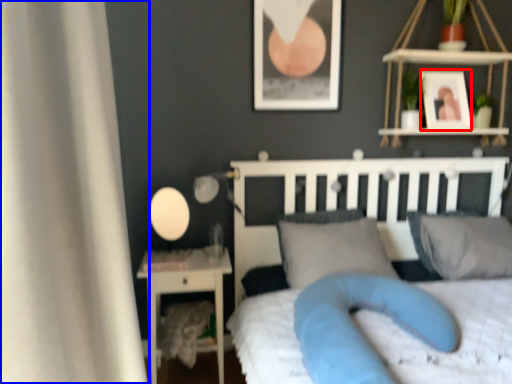
Question: Among these objects, which one is farthest to the camera, picture frame (highlighted by a red box) or curtain (highlighted by a blue box)?

Choices:
 (A) picture frame
 (B) curtain

Answer: (A)